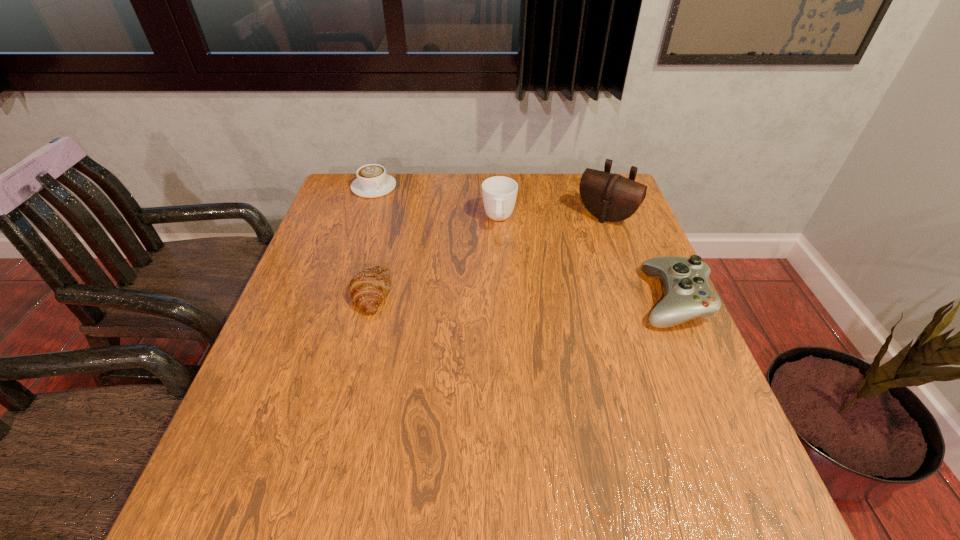
The image size is (960, 540). I want to click on vacant space located 0.230m with the handle on the side of the third object from right to left, so click(497, 292).

The height and width of the screenshot is (540, 960). I want to click on free point located with the handle on the side of the third object from right to left, so click(496, 323).

Where is `vacant space located with the handle on the side of the third object from right to left`? Image resolution: width=960 pixels, height=540 pixels. vacant space located with the handle on the side of the third object from right to left is located at coordinates [x=498, y=258].

Identify the location of vacant space located 0.150m with the flap open on the tallest object. The image size is (960, 540). (571, 256).

The image size is (960, 540). I want to click on vacant space located with the flap open on the tallest object, so click(560, 271).

At what (x,y) coordinates should I click in order to perform the action: click on free point located 0.280m with the flap open on the tallest object. Please return your answer as a coordinate pair (x, y). Image resolution: width=960 pixels, height=540 pixels. Looking at the image, I should click on (549, 284).

Identify the location of cappuccino present at the far edge. This screenshot has width=960, height=540. (372, 181).

The image size is (960, 540). In order to click on cup that is positioned at the far edge in this screenshot , I will do `click(499, 193)`.

This screenshot has width=960, height=540. I want to click on pouch present at the far edge, so [610, 197].

Identify the location of crescent roll that is positioned at the left edge. This screenshot has height=540, width=960. (367, 289).